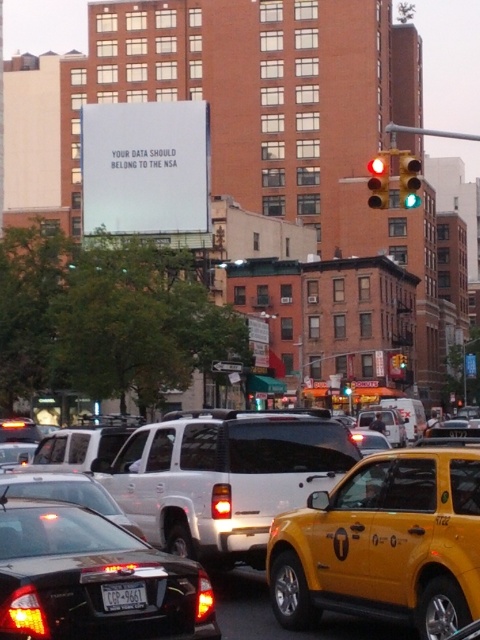
Consider the image. Between yellow matte taxi cab at center and red glass traffic light at center, which one appears on the left side from the viewer's perspective?

From the viewer's perspective, yellow matte taxi cab at center appears more on the left side.

In the scene shown: Who is more distant from viewer, [189,550] or [371,177]?

Point [371,177]

Locate an element on the screen. Image resolution: width=480 pixels, height=640 pixels. yellow matte taxi cab at center is located at coordinates (224, 476).

Which of these two, yellow matte taxi cab at center or green glass traffic light at upper right, stands shorter?

green glass traffic light at upper right

Does yellow matte taxi cab at center have a larger size compared to green glass traffic light at upper right?

Indeed, yellow matte taxi cab at center has a larger size compared to green glass traffic light at upper right.

You are a GUI agent. You are given a task and a screenshot of the screen. Output one action in this format:
    pyautogui.click(x=<x>, y=<y>)
    Task: Click on the yellow matte taxi cab at center
    
    Given the screenshot: What is the action you would take?
    pyautogui.click(x=224, y=476)

Which is behind, point (316, 572) or point (386, 163)?

The point (386, 163) is behind.

How much distance is there between yellow matte taxi at lower right and red glass traffic light at center?

A distance of 13.11 meters exists between yellow matte taxi at lower right and red glass traffic light at center.

You are a GUI agent. You are given a task and a screenshot of the screen. Output one action in this format:
    pyautogui.click(x=<x>, y=<y>)
    Task: Click on the yellow matte taxi at lower right
    The width and height of the screenshot is (480, 640).
    Given the screenshot: What is the action you would take?
    pyautogui.click(x=384, y=545)